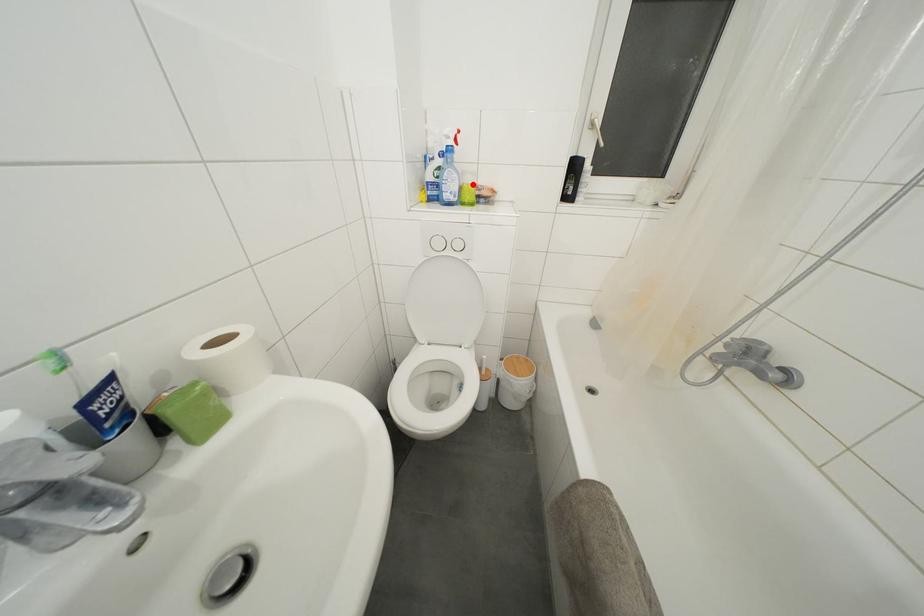
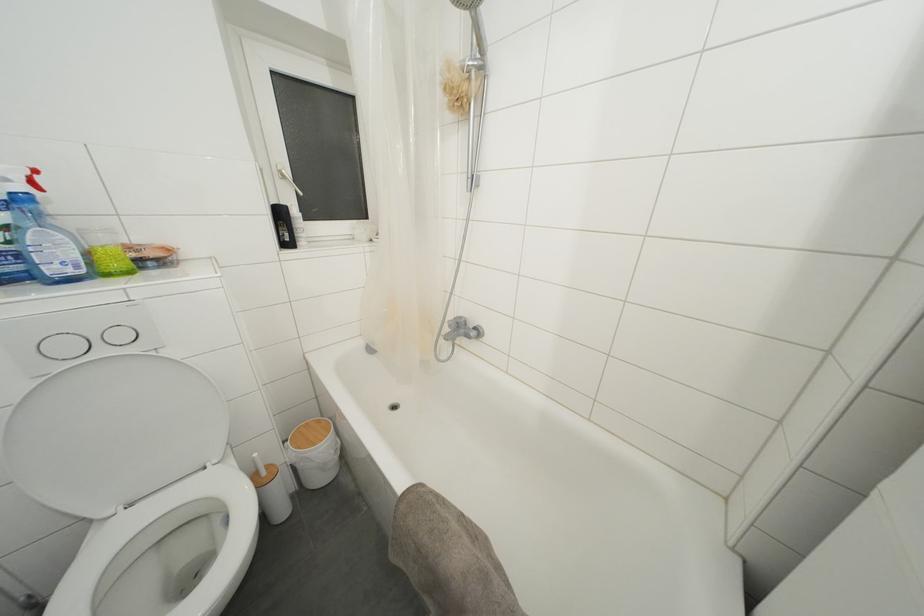
Question: I am providing you with two images of the same scene from different viewpoints. A red point is shown in image1. For the corresponding object point in image2, is it positioned nearer or farther from the camera?

Choices:
 (A) Nearer
 (B) Farther

Answer: (B)